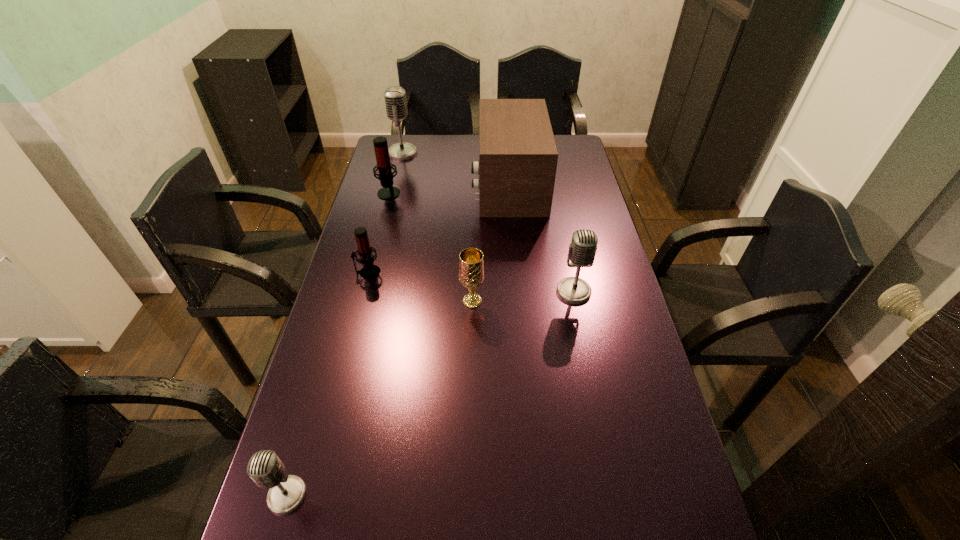
Find the location of a particular element. The image size is (960, 540). the tallest microphone is located at coordinates (395, 98).

Identify the location of the farthest gray microphone. (395, 98).

Where is `radio receiver`? The image size is (960, 540). radio receiver is located at coordinates (518, 156).

The height and width of the screenshot is (540, 960). I want to click on the bigger red microphone, so click(x=384, y=166).

Find the location of a particular element. Image resolution: width=960 pixels, height=540 pixels. the farther red microphone is located at coordinates pyautogui.click(x=384, y=166).

I want to click on the second biggest gray microphone, so click(582, 250).

The image size is (960, 540). Find the location of `the rightmost microphone`. the rightmost microphone is located at coordinates (582, 250).

This screenshot has height=540, width=960. Find the location of `chalice`. chalice is located at coordinates (471, 264).

Where is `the smallest gray microphone`? the smallest gray microphone is located at coordinates (287, 492).

This screenshot has height=540, width=960. I want to click on the nearest object, so click(x=287, y=492).